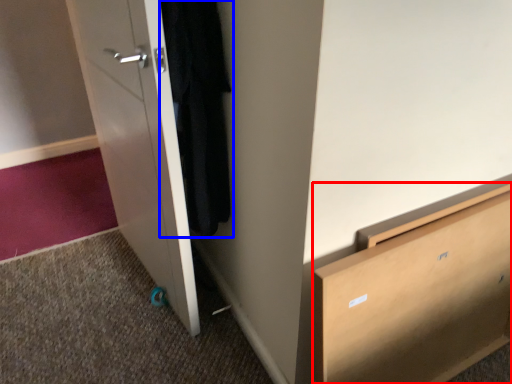
Question: Which object appears farthest to the camera in this image, chest of drawers (highlighted by a red box) or clothing (highlighted by a blue box)?

Choices:
 (A) chest of drawers
 (B) clothing

Answer: (B)